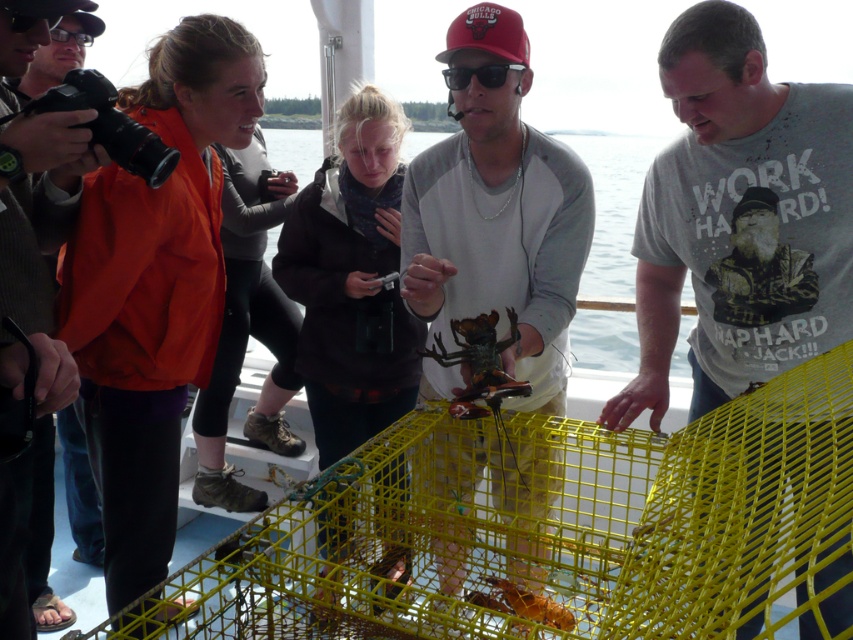
You are holding a matte black camera at left and want to take a photo of the lobster trap. Since the camera is 4.02 feet away from the lobster trap, is it within the recommended 5 feet range for clear photos?

The matte black camera at left is 4.02 feet away from the lobster trap, which is within the recommended 5 feet range for clear photos. Yes, it is within range.

You are a photographer trying to capture the lobster at the center while holding your matte black camera at left. Can you take a clear photo of the shiny metallic lobster at center without the camera blocking the view?

The shiny metallic lobster at center is closer to the viewer than the matte black camera at left, so the camera would not block the view. You can take a clear photo.